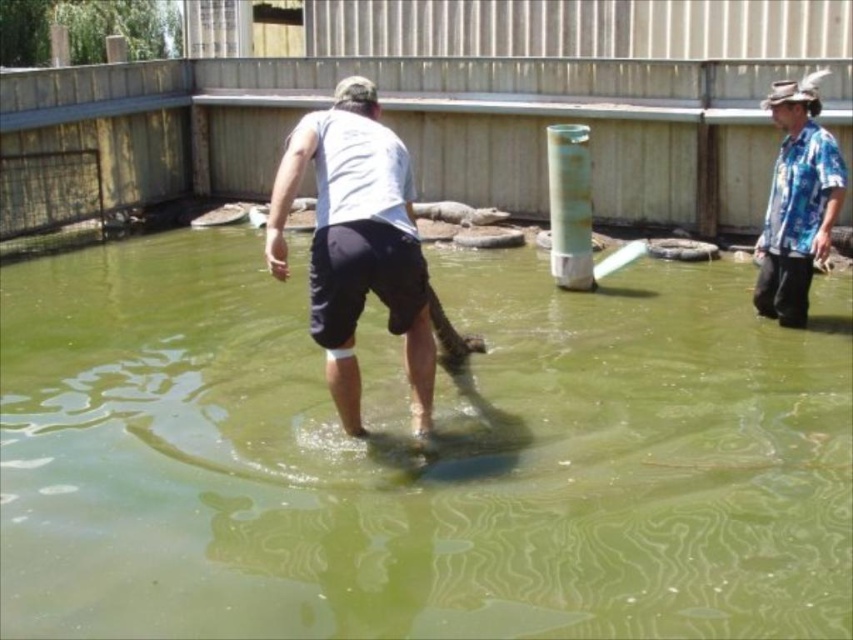
Is the position of green smooth water at center less distant than that of white matte shorts at center?

No, it is not.

Which of these two, green smooth water at center or white matte shorts at center, stands taller?

white matte shorts at center is taller.

Image resolution: width=853 pixels, height=640 pixels. I want to click on green smooth water at center, so click(416, 456).

Can you confirm if white matte shorts at center is bigger than blue floral shirt at right?

Yes, white matte shorts at center is bigger than blue floral shirt at right.

Can you confirm if white matte shorts at center is positioned above blue floral shirt at right?

Actually, white matte shorts at center is below blue floral shirt at right.

Who is more distant from viewer, (404, 328) or (798, 109)?

The point (798, 109) is more distant.

The image size is (853, 640). In order to click on white matte shorts at center in this screenshot , I will do click(x=357, y=243).

Who is taller, green smooth water at center or blue floral shirt at right?

blue floral shirt at right is taller.

Is point (578, 320) positioned before point (815, 157)?

No.

This screenshot has width=853, height=640. In order to click on green smooth water at center in this screenshot , I will do `click(416, 456)`.